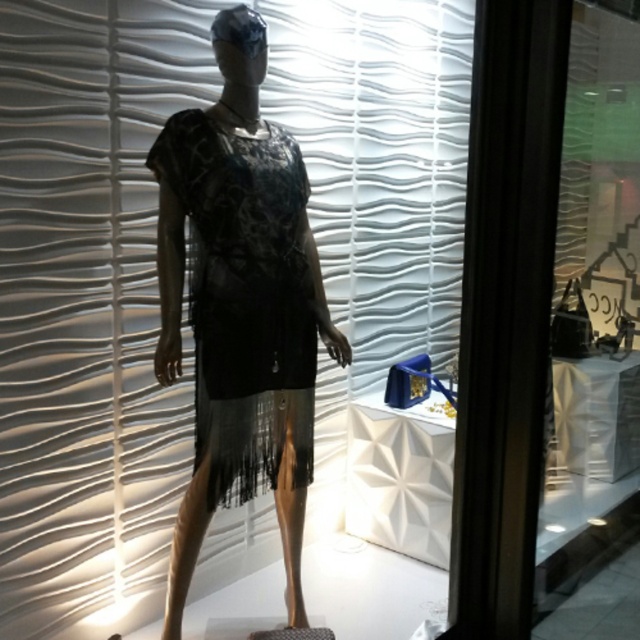
Question: Among these objects, which one is nearest to the camera?

Choices:
 (A) white matte blind at upper center
 (B) black mesh dress at center
 (C) black lace dress at center

Answer: (A)

Question: Does black lace dress at center have a smaller size compared to black mesh dress at center?

Choices:
 (A) yes
 (B) no

Answer: (B)

Question: Can you confirm if black lace dress at center is positioned to the right of black mesh dress at center?

Choices:
 (A) yes
 (B) no

Answer: (A)

Question: Which point is closer to the camera taking this photo?

Choices:
 (A) (438, 132)
 (B) (202, 419)

Answer: (B)

Question: Which of the following is the closest to the observer?

Choices:
 (A) (17, 54)
 (B) (282, 314)
 (C) (248, 42)

Answer: (A)

Question: Does black lace dress at center appear on the right side of black mesh dress at center?

Choices:
 (A) yes
 (B) no

Answer: (A)